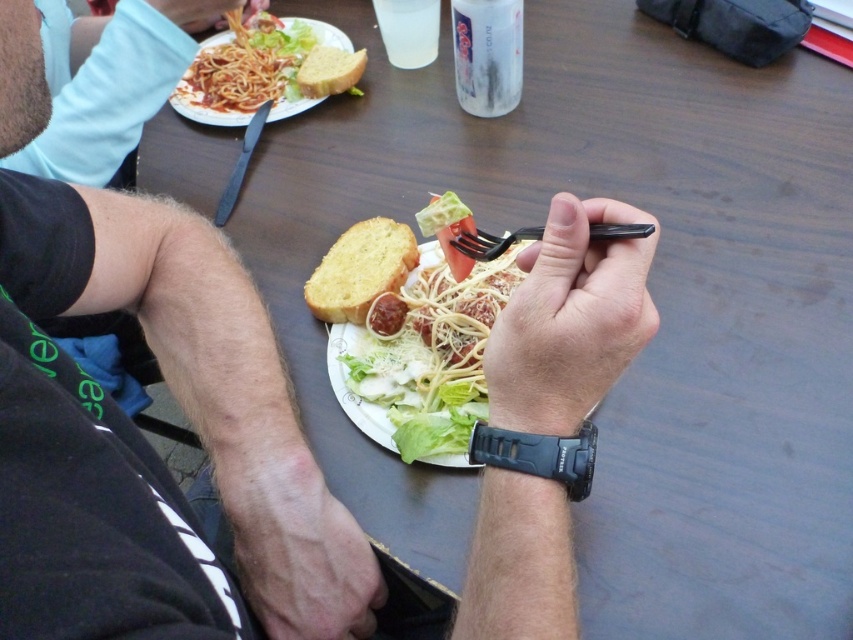
Looking at this image, you are setting up a picnic and have a white paper plate at upper left and a black plastic fork at center. Which item should you place first if you want to ensure there is enough space for both on the table?

The white paper plate at upper left is larger in size than the black plastic fork at center, so you should place the white paper plate at upper left first to ensure there is enough space for both items.

You are a waiter at a restaurant and you need to place a new dish on the table. The table has coordinates from 0 to 1 in both x and y directions. The center of the table is at point 0.5,0.5. You want to place the dish as close as possible to the point 0.5,0.5 without overlapping any existing items. Is there space available at point (x=569, y=320)?

The point (x=569, y=320) is occupied by the matte black fork at center. Therefore, you cannot place the dish there as it is already occupied by the matte black fork at center.